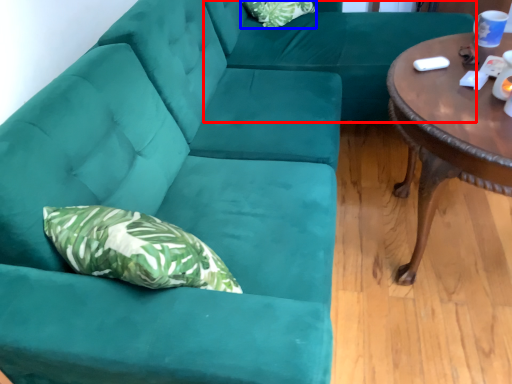
Question: Which object is further to the camera taking this photo, couch (highlighted by a red box) or pillow (highlighted by a blue box)?

Choices:
 (A) couch
 (B) pillow

Answer: (B)